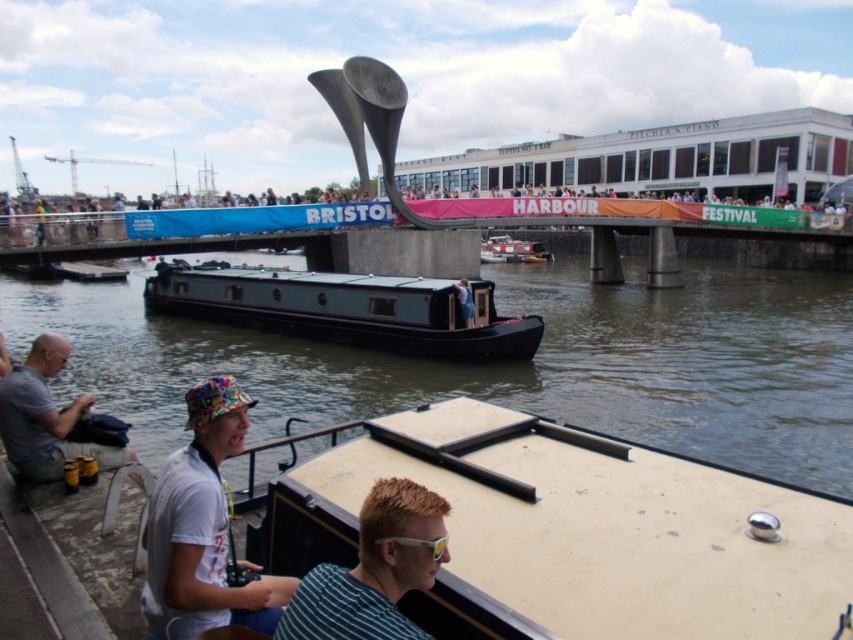
You are a crane operator trying to lower a heavy load onto the teal matte boat at center and the metallic gray barge at center. Which vessel should you avoid because it is taller and might hit the crane?

You should avoid the teal matte boat at center because it is much taller than the metallic gray barge at center, which could cause a collision with the crane.

You are standing at the edge of Bristol Harbour and want to reach the point marked at coordinates point (283, 328). Can you walk directly to it from your current position?

The point (283, 328) is 111.78 feet away from the viewer. Since it is a coordinate in the water, you cannot walk directly to it as it requires crossing water.